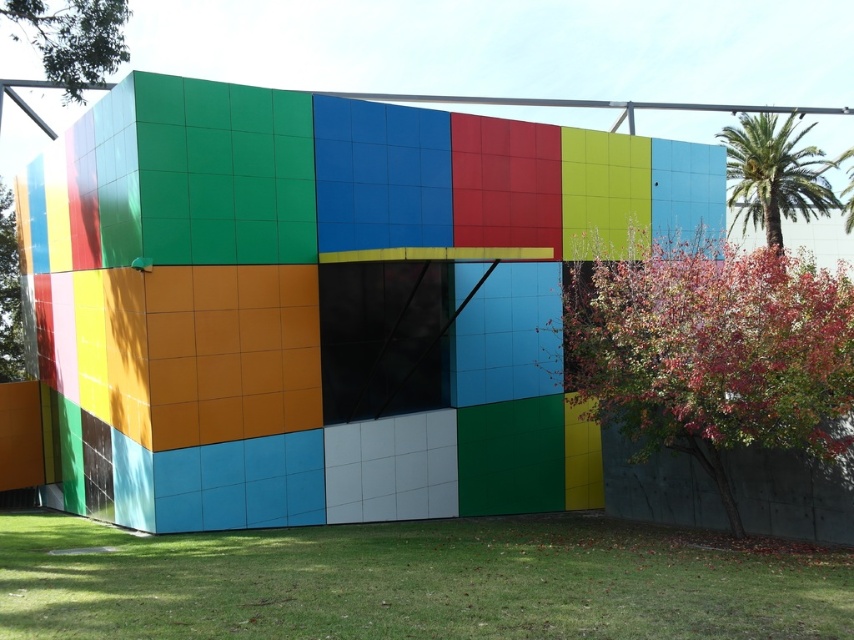
Question: Where is green grass at lower center located in relation to green leafy palm tree at upper right in the image?

Choices:
 (A) right
 (B) left

Answer: (B)

Question: From the image, what is the correct spatial relationship of green grass at lower center in relation to green leafy palm tree at upper right?

Choices:
 (A) below
 (B) above

Answer: (A)

Question: Is green grass at lower center above green leafy palm tree at upper right?

Choices:
 (A) no
 (B) yes

Answer: (A)

Question: Which object is farther from the camera taking this photo?

Choices:
 (A) green grass at lower center
 (B) green leafy palm tree at upper right

Answer: (B)

Question: Which point is farther to the camera?

Choices:
 (A) (806, 177)
 (B) (668, 630)

Answer: (A)